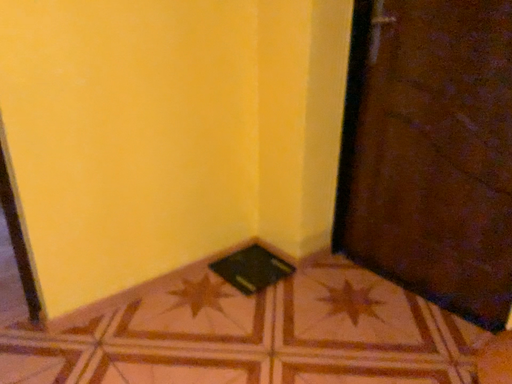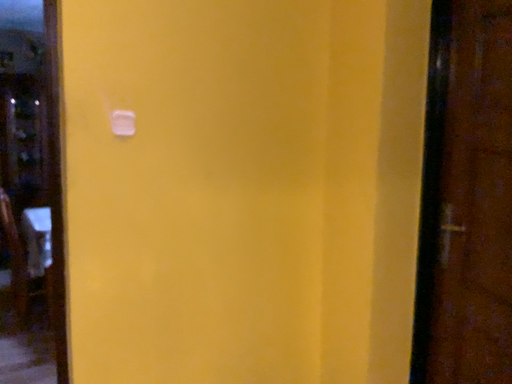
Question: Which way did the camera rotate in the video?

Choices:
 (A) rotated left
 (B) rotated right

Answer: (A)